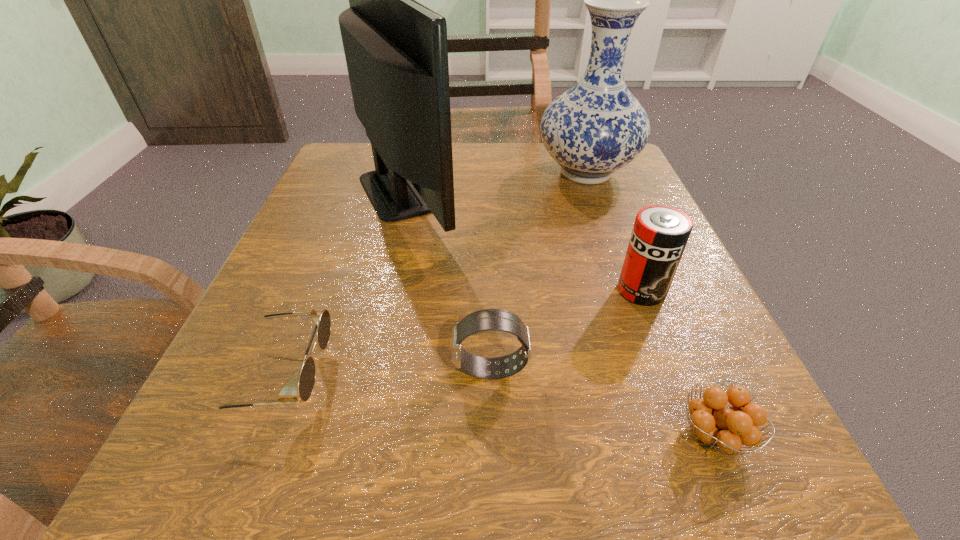
What are the coordinates of `computer monitor` in the screenshot? It's located at (396, 50).

Locate an element on the screen. The image size is (960, 540). vase is located at coordinates (597, 127).

The image size is (960, 540). In order to click on the fourth shortest object in this screenshot , I will do `click(660, 233)`.

Locate an element on the screen. can is located at coordinates 660,233.

This screenshot has width=960, height=540. What are the coordinates of `the fourth object from right to left` in the screenshot? It's located at (488, 319).

This screenshot has width=960, height=540. What are the coordinates of `the fourth tallest object` in the screenshot? It's located at (488, 319).

Identify the location of sunglasses. This screenshot has width=960, height=540. (288, 395).

This screenshot has height=540, width=960. What are the coordinates of `orange fruit` in the screenshot? It's located at (726, 428).

I want to click on vacant area situated 0.340m on the front-facing side of the computer monitor, so click(628, 191).

You are a GUI agent. You are given a task and a screenshot of the screen. Output one action in this format:
    pyautogui.click(x=<x>, y=<y>)
    Task: Click on the free point located on the front of the vase
    The width and height of the screenshot is (960, 540).
    Given the screenshot: What is the action you would take?
    pyautogui.click(x=653, y=356)